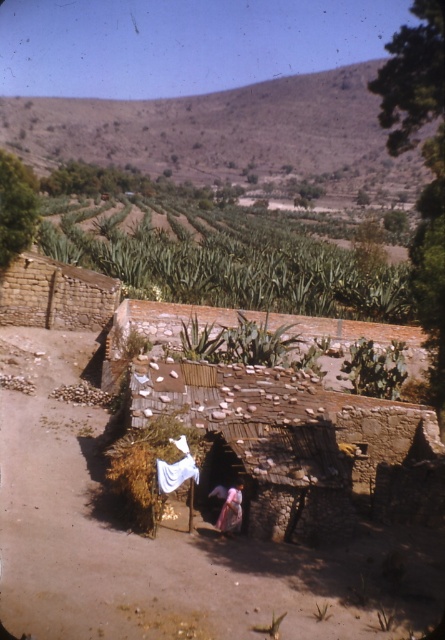
You are standing at the entrance of the rustic stone structure with a thatched roof in the foreground. There is a brown dirt track at center represented by point (165, 540). If you want to walk to the dirt track, which direction should you head from the structure?

The brown dirt track at center is represented by point (165, 540), so you should head towards the center from the rustic stone structure with a thatched roof to reach it.

Consider the image. Based on the scene description, where is the brown dirt track at center located in terms of coordinates?

The brown dirt track at center is located at coordinates point (165, 540).